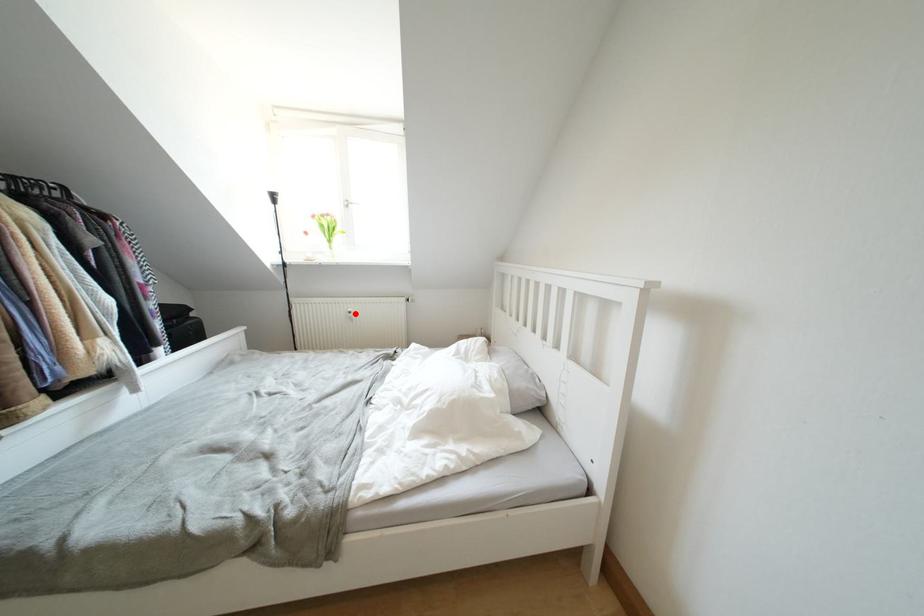
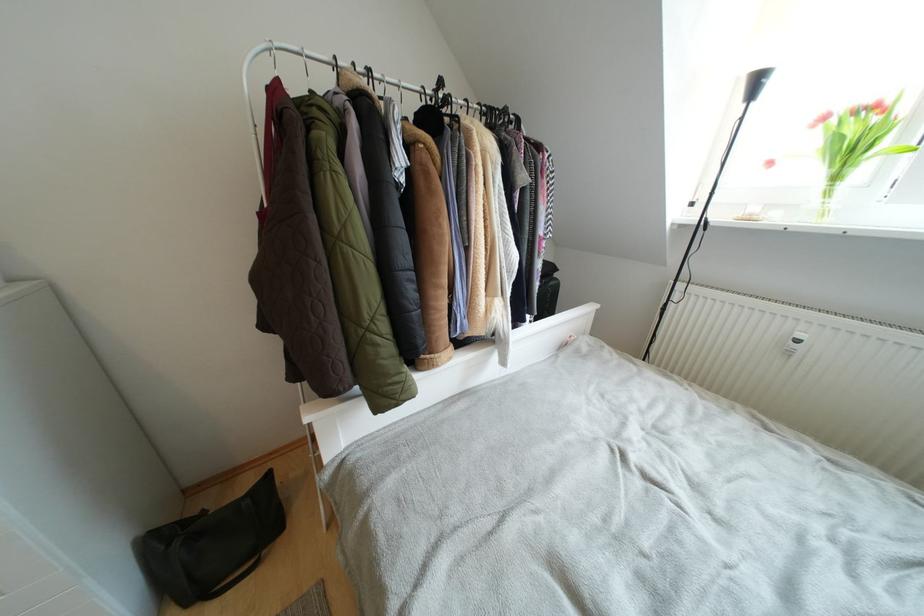
In the second image, find the point that corresponds to the highlighted location in the first image.

(805, 339)